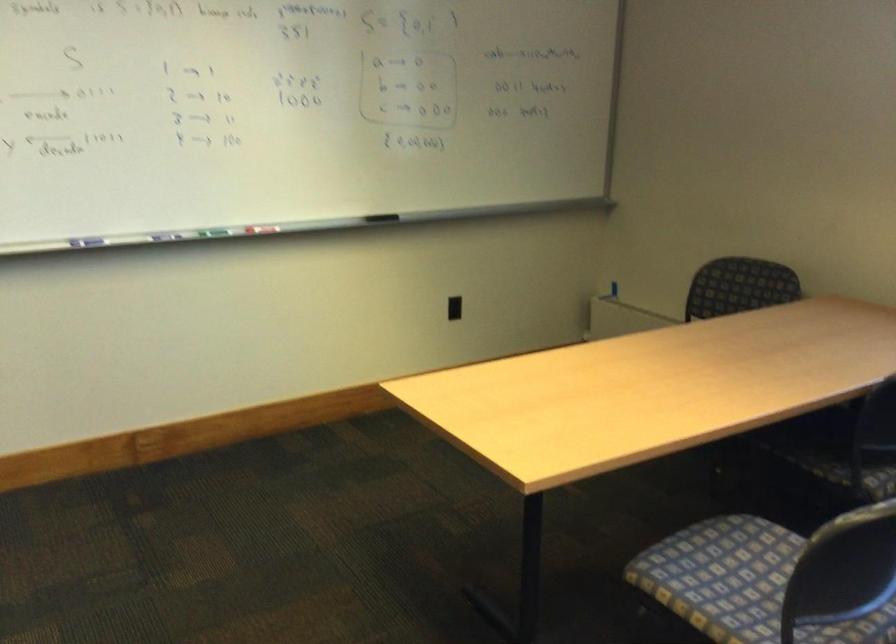
Where would you plugg the black power outlet? Please return your answer as a coordinate pair (x, y).

(453, 308)